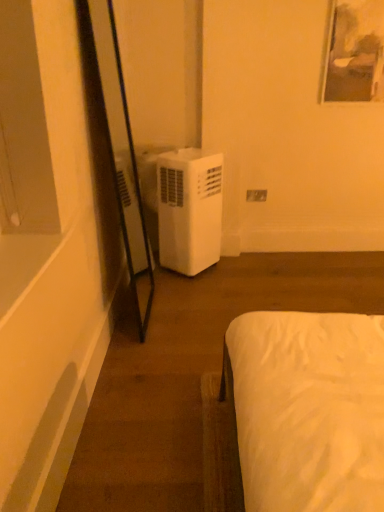
Find the location of a particular element. The width and height of the screenshot is (384, 512). vacant space in front of white plastic air conditioner at left is located at coordinates (194, 294).